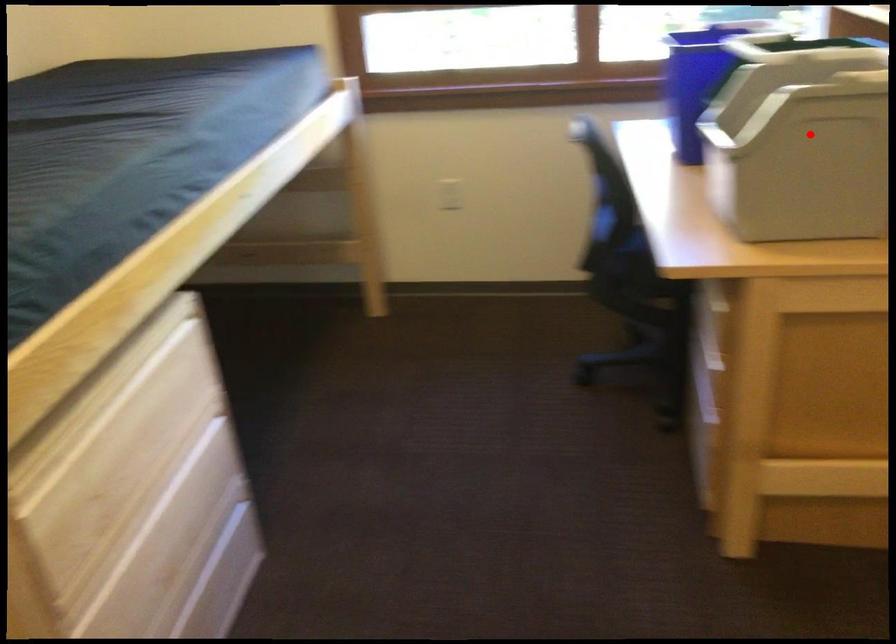
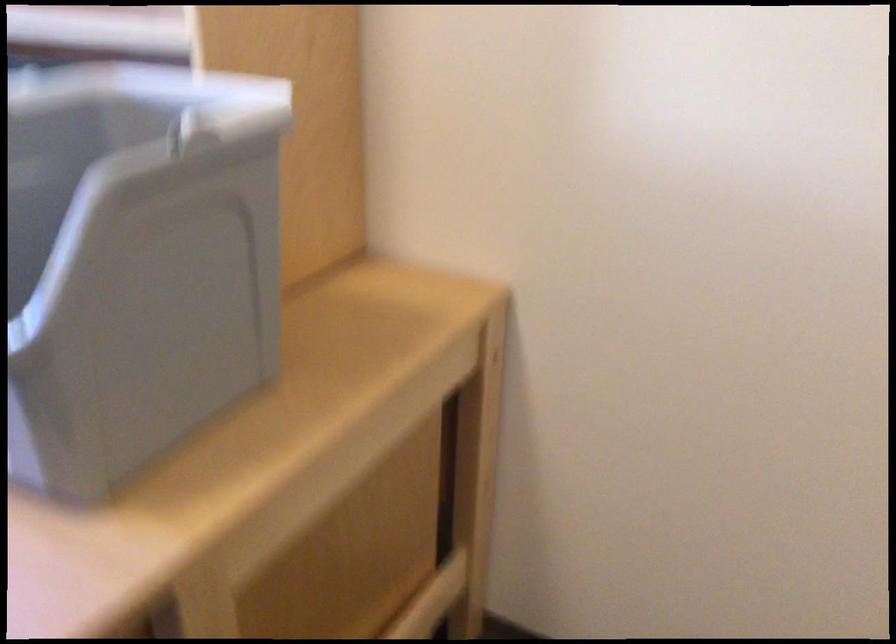
Locate, in the second image, the point that corresponds to the highlighted location in the first image.

(135, 263)